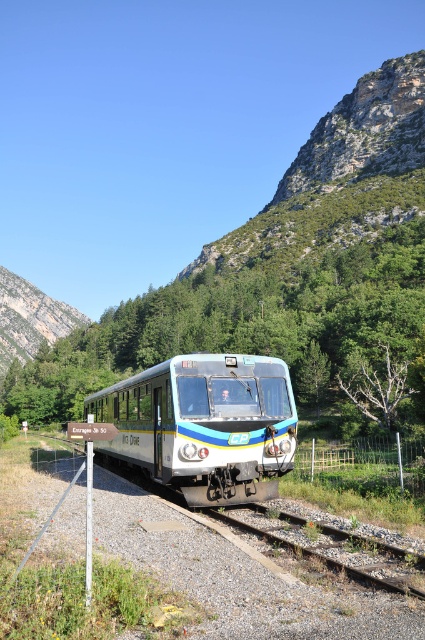
You are standing on a platform near the brown gravel train track at lower center. The safety regulations state that you must stay at least 2 meters away from the track for safety. Are you currently within the safe distance?

The brown gravel train track at lower center is 7.55 meters away from the viewer, which is more than the required 2 meters safety distance. Therefore, you are within the safe zone.

Looking at this image, you are a railway engineer inspecting the tracks. You need to locate the brown gravel train track at lower center. According to the coordinates provided, where exactly is it positioned?

The brown gravel train track at lower center is located at point 0.852 on the x axis and 0.788 on the y axis.

You are a photographer planning to capture a photo of the metallic silver train at center and the rugged stone mountain at upper left. Based on their sizes in the image, which object would you focus on first to ensure both are clearly visible in the frame?

The metallic silver train at center is smaller compared to rugged stone mountain at upper left. To ensure both are clearly visible, focus on the metallic silver train at center first as it requires more attention due to its smaller size.